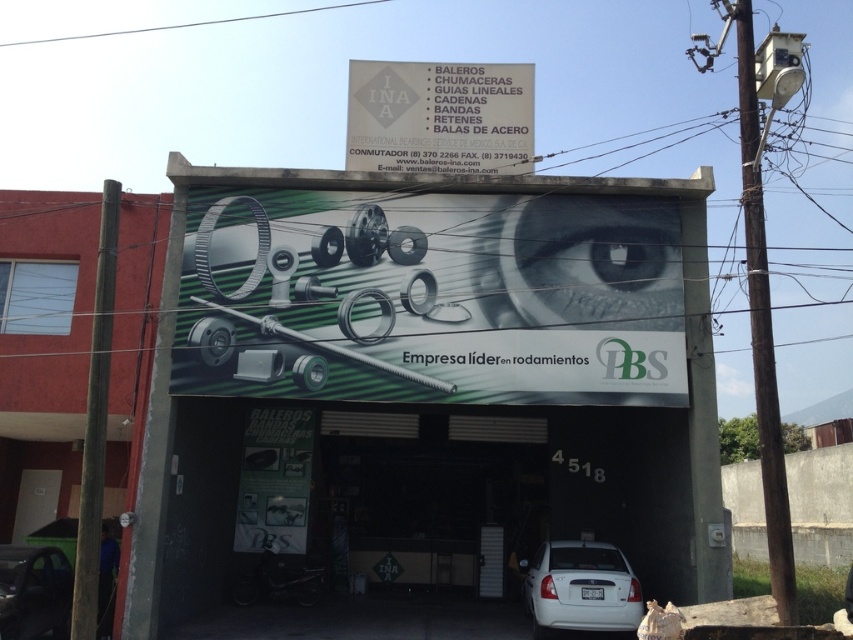
Question: Does metallic silver pipes at center come in front of white matte car at lower right?

Choices:
 (A) no
 (B) yes

Answer: (B)

Question: Is metallic silver pipes at center below shiny black car at lower left?

Choices:
 (A) no
 (B) yes

Answer: (A)

Question: Which of the following is the closest to the observer?

Choices:
 (A) shiny black car at lower left
 (B) white paper at upper center
 (C) gray matte eye at upper center
 (D) white paper at lower center

Answer: (A)

Question: Which object appears closest to the camera in this image?

Choices:
 (A) white paper at upper center
 (B) shiny black car at lower left
 (C) green metallic gear at center
 (D) white matte car at lower right

Answer: (B)

Question: Does white paper at upper center appear over shiny black car at lower left?

Choices:
 (A) no
 (B) yes

Answer: (B)

Question: Which of these objects is positioned closest to the shiny black car at lower left?

Choices:
 (A) white paper at lower center
 (B) gray matte eye at upper center
 (C) metallic silver pipes at center
 (D) green metallic gear at center

Answer: (C)